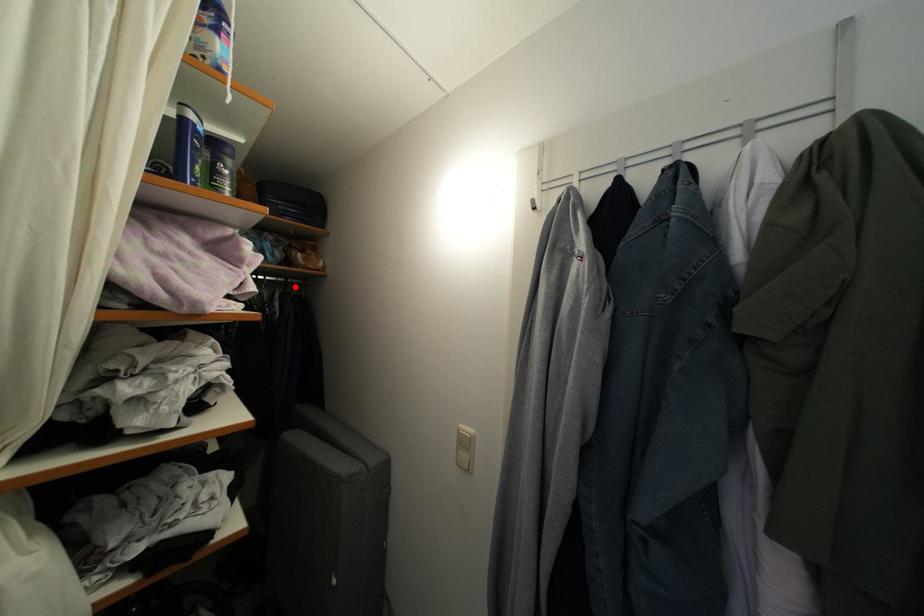
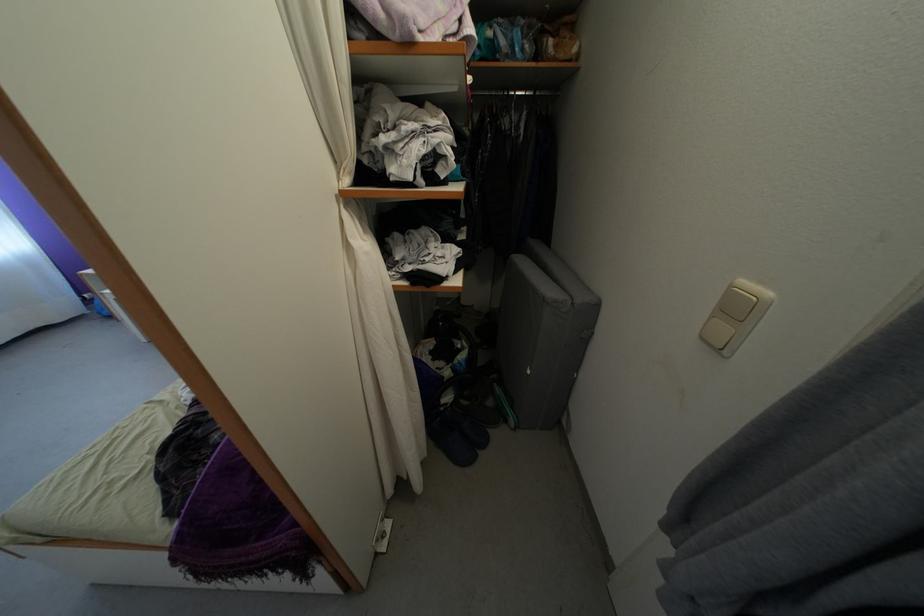
Question: A red point is marked in image1. In image2, is the corresponding 3D point closer to the camera or farther? Reply with the corresponding letter.

Choices:
 (A) The corresponding 3D point is closer.
 (B) The corresponding 3D point is farther.

Answer: (A)